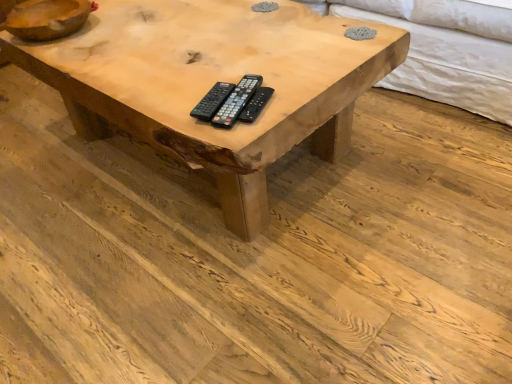
You are a GUI agent. You are given a task and a screenshot of the screen. Output one action in this format:
    pyautogui.click(x=<x>, y=<y>)
    Task: Click on the natural wood coffee table at center
    
    Given the screenshot: What is the action you would take?
    pyautogui.click(x=214, y=83)

This screenshot has width=512, height=384. What do you see at coordinates (214, 83) in the screenshot? I see `natural wood coffee table at center` at bounding box center [214, 83].

Locate an element on the screen. The image size is (512, 384). natural wood coffee table at center is located at coordinates (214, 83).